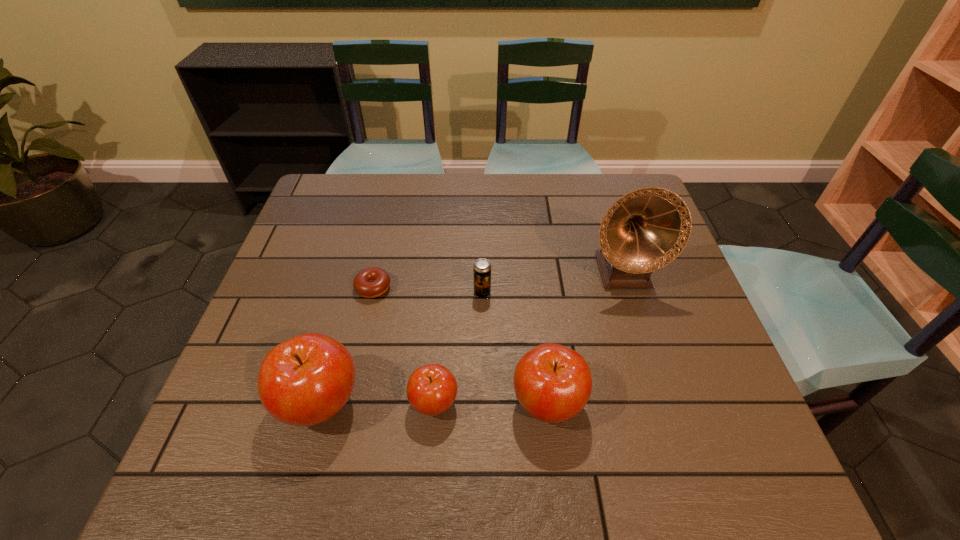
With all apples evenly spaced, where should an extra apple be placed on the right to continue the pattern? Please point out a vacant space. Please provide its 2D coordinates. Your answer should be formatted as a tuple, i.e. [(x, y)], where the tuple contains the x and y coordinates of a point satisfying the conditions above.

[(660, 403)]